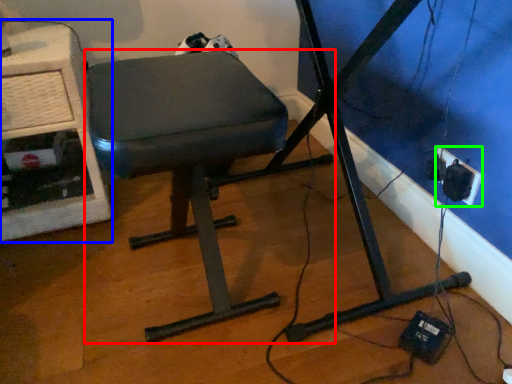
Question: Estimate the real-world distances between objects in this image. Which object is farther from furniture (highlighted by a red box), computer desk (highlighted by a blue box) or electric outlet (highlighted by a green box)?

Choices:
 (A) computer desk
 (B) electric outlet

Answer: (B)